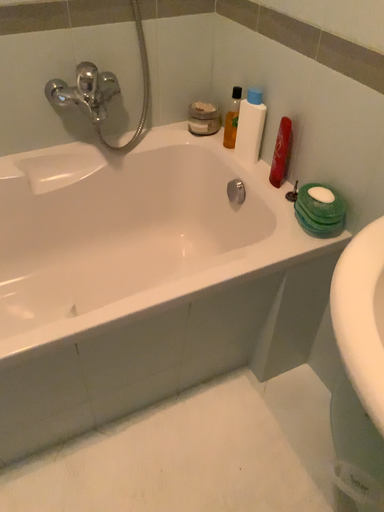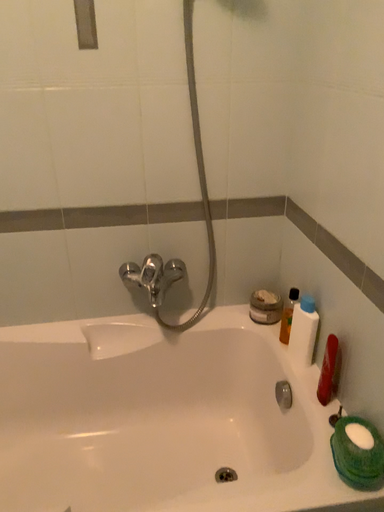
Question: How did the camera likely rotate when shooting the video?

Choices:
 (A) rotated upward
 (B) rotated downward

Answer: (A)